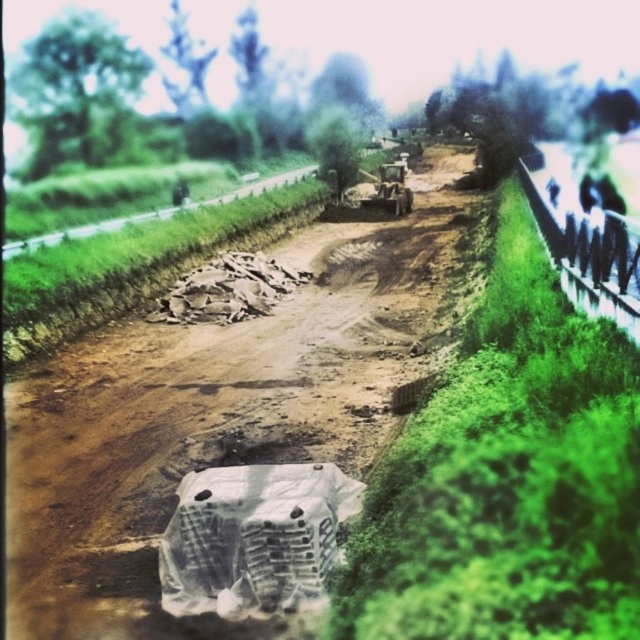
Question: Is green plastic fence at right above green plastic fence at center?

Choices:
 (A) yes
 (B) no

Answer: (B)

Question: Is green plastic fence at right closer to the viewer compared to green plastic fence at center?

Choices:
 (A) yes
 (B) no

Answer: (A)

Question: Can you confirm if brown sandy dirt track at center is bigger than green plastic fence at right?

Choices:
 (A) no
 (B) yes

Answer: (B)

Question: Which point appears farthest from the camera in this image?

Choices:
 (A) (564, 291)
 (B) (115, 422)

Answer: (B)

Question: Which of the following is the farthest from the observer?

Choices:
 (A) brown sandy dirt track at center
 (B) green plastic fence at right

Answer: (B)

Question: Which point is farther to the camera?

Choices:
 (A) (157, 378)
 (B) (221, 196)

Answer: (B)